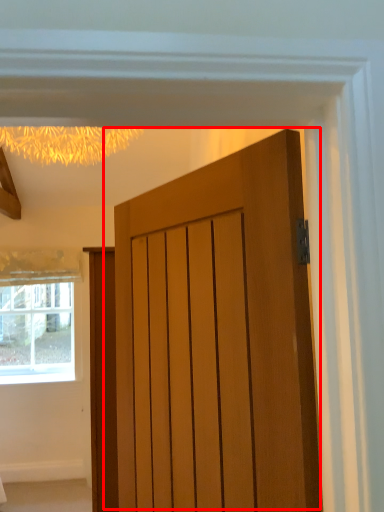
Question: In this image, where is door (annotated by the red box) located relative to window?

Choices:
 (A) right
 (B) left

Answer: (A)